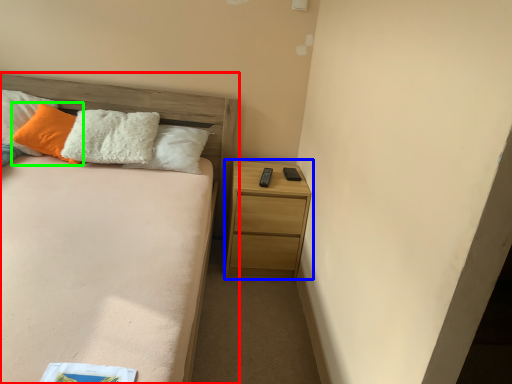
Question: Which is farther away from bed (highlighted by a red box)? nightstand (highlighted by a blue box) or pillow (highlighted by a green box)?

Choices:
 (A) nightstand
 (B) pillow

Answer: (A)